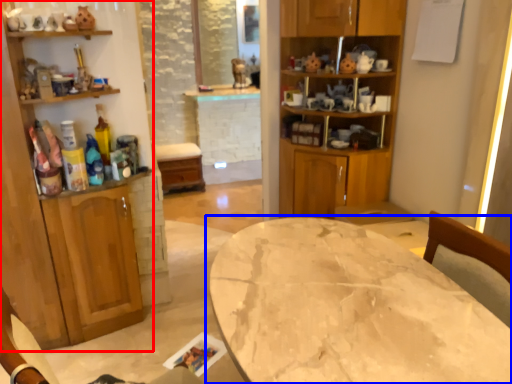
Question: Which point is closer to the camera, cabinetry (highlighted by a red box) or table (highlighted by a blue box)?

Choices:
 (A) cabinetry
 (B) table

Answer: (B)